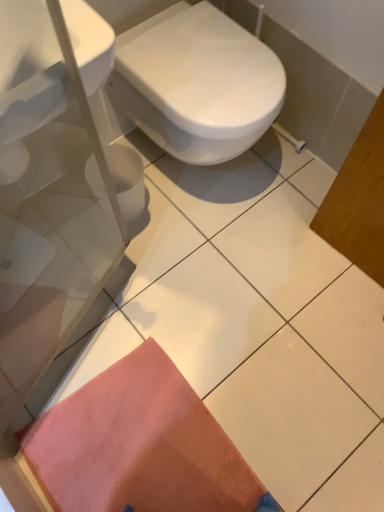
Question: Considering their positions, is orange textured mat at lower left located in front of or behind white glossy sink at upper left?

Choices:
 (A) behind
 (B) front

Answer: (A)

Question: From the image's perspective, is orange textured mat at lower left positioned above or below white glossy sink at upper left?

Choices:
 (A) below
 (B) above

Answer: (A)

Question: Which of these objects is positioned farthest from the white glossy bidet at center?

Choices:
 (A) orange textured mat at lower left
 (B) white glossy sink at upper left

Answer: (A)

Question: Considering the real-world distances, which object is closest to the white glossy sink at upper left?

Choices:
 (A) orange textured mat at lower left
 (B) white glossy bidet at center

Answer: (B)